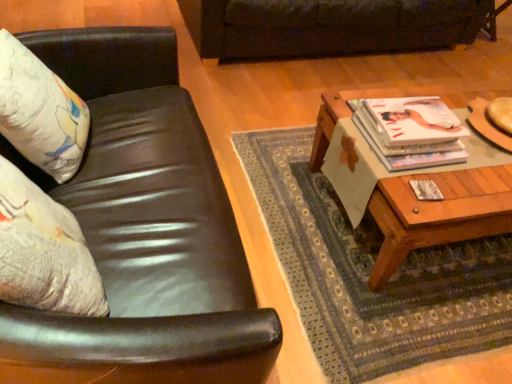
Question: From a real-world perspective, is matte white pillow at left under white glossy magazine at upper right?

Choices:
 (A) yes
 (B) no

Answer: (B)

Question: Does matte white pillow at left have a larger size compared to white glossy magazine at upper right?

Choices:
 (A) yes
 (B) no

Answer: (A)

Question: From the image's perspective, is matte white pillow at left located beneath white glossy magazine at upper right?

Choices:
 (A) yes
 (B) no

Answer: (B)

Question: Does matte white pillow at left contain white glossy magazine at upper right?

Choices:
 (A) yes
 (B) no

Answer: (B)

Question: Is matte white pillow at left positioned beyond the bounds of white glossy magazine at upper right?

Choices:
 (A) yes
 (B) no

Answer: (A)

Question: Is matte white pillow at left wider or thinner than leather couch at upper center, which appears as the second studio couch when ordered from the bottom?

Choices:
 (A) thin
 (B) wide

Answer: (A)

Question: From the image's perspective, is matte white pillow at left above or below leather couch at upper center, which appears as the second studio couch when ordered from the bottom?

Choices:
 (A) below
 (B) above

Answer: (A)

Question: Do you think matte white pillow at left is within leather couch at upper center, which ranks as the 1th studio couch in top-to-bottom order, or outside of it?

Choices:
 (A) inside
 (B) outside

Answer: (B)

Question: From a real-world perspective, is matte white pillow at left positioned above or below leather couch at upper center, which ranks as the 1th studio couch in top-to-bottom order?

Choices:
 (A) below
 (B) above

Answer: (B)

Question: Considering the relative positions of white glossy magazine at upper right and leather couch at upper center, which appears as the second studio couch when ordered from the bottom, in the image provided, is white glossy magazine at upper right to the left or to the right of leather couch at upper center, which appears as the second studio couch when ordered from the bottom,?

Choices:
 (A) right
 (B) left

Answer: (A)

Question: Is white glossy magazine at upper right inside or outside of leather couch at upper center, which is the 1th studio couch in back-to-front order?

Choices:
 (A) outside
 (B) inside

Answer: (A)

Question: From the image's perspective, relative to leather couch at upper center, which appears as the second studio couch when viewed from the front, is white glossy magazine at upper right above or below?

Choices:
 (A) above
 (B) below

Answer: (B)

Question: Considering the positions of white glossy magazine at upper right and leather couch at upper center, which is the 1th studio couch in back-to-front order, in the image, is white glossy magazine at upper right wider or thinner than leather couch at upper center, which is the 1th studio couch in back-to-front order,?

Choices:
 (A) thin
 (B) wide

Answer: (A)

Question: In the image, is matte white pillow at left positioned in front of or behind white glossy magazine at upper right?

Choices:
 (A) front
 (B) behind

Answer: (A)

Question: In terms of height, does matte white pillow at left look taller or shorter compared to white glossy magazine at upper right?

Choices:
 (A) tall
 (B) short

Answer: (A)